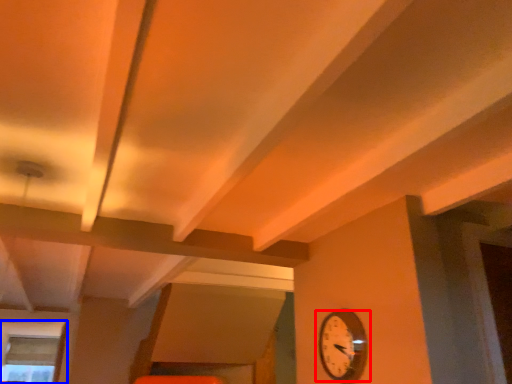
Question: Which object appears closest to the camera in this image, wall clock (highlighted by a red box) or window (highlighted by a blue box)?

Choices:
 (A) wall clock
 (B) window

Answer: (A)